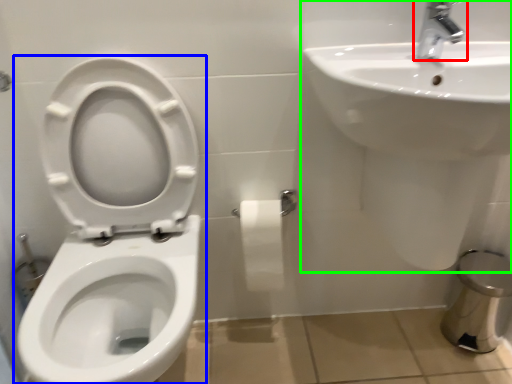
Question: Estimate the real-world distances between objects in this image. Which object is farther from tap (highlighted by a red box), toilet (highlighted by a blue box) or sink (highlighted by a green box)?

Choices:
 (A) toilet
 (B) sink

Answer: (A)